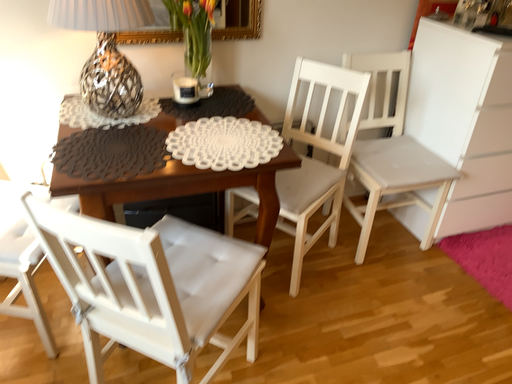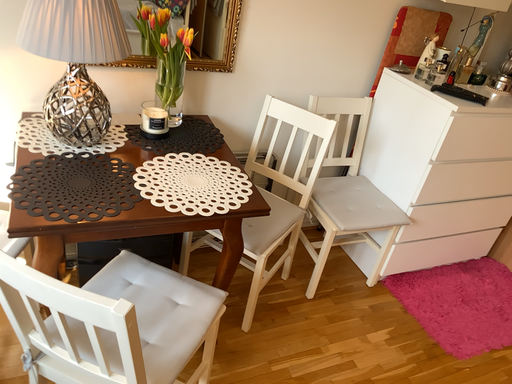
Question: Which way did the camera rotate in the video?

Choices:
 (A) rotated left
 (B) rotated right

Answer: (B)